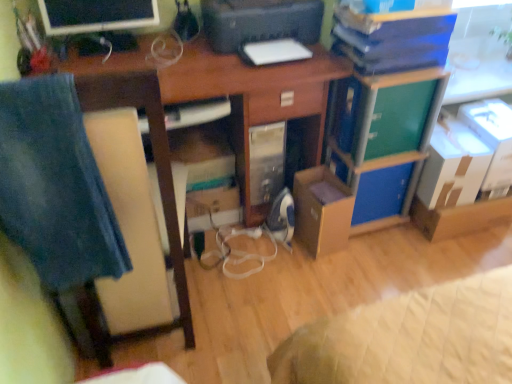
Question: Is blue cardboard box at center-right thinner than black plastic printer at upper center?

Choices:
 (A) no
 (B) yes

Answer: (B)

Question: Are blue cardboard box at center-right and black plastic printer at upper center far apart?

Choices:
 (A) no
 (B) yes

Answer: (A)

Question: Is blue cardboard box at center-right outside black plastic printer at upper center?

Choices:
 (A) no
 (B) yes

Answer: (B)

Question: From a real-world perspective, does blue cardboard box at center-right sit lower than black plastic printer at upper center?

Choices:
 (A) yes
 (B) no

Answer: (A)

Question: Does blue cardboard box at center-right have a greater height compared to black plastic printer at upper center?

Choices:
 (A) yes
 (B) no

Answer: (A)

Question: From the image's perspective, relative to green matte file cabinet at center-right, is white cardboard box at upper right, the fourth cardboard box from the left, above or below?

Choices:
 (A) above
 (B) below

Answer: (B)

Question: In the image, is white cardboard box at upper right, the fourth cardboard box from the left, on the left side or the right side of green matte file cabinet at center-right?

Choices:
 (A) left
 (B) right

Answer: (B)

Question: Is white cardboard box at upper right, which ranks as the first cardboard box in right-to-left order, wider or thinner than green matte file cabinet at center-right?

Choices:
 (A) wide
 (B) thin

Answer: (B)

Question: Looking at the image, does white cardboard box at upper right, which ranks as the first cardboard box in right-to-left order, seem bigger or smaller compared to green matte file cabinet at center-right?

Choices:
 (A) small
 (B) big

Answer: (A)

Question: Is point (291, 1) closer or farther from the camera than point (367, 220)?

Choices:
 (A) farther
 (B) closer

Answer: (B)

Question: Would you say black plastic printer at upper center is inside or outside blue cardboard box at center-right?

Choices:
 (A) outside
 (B) inside

Answer: (A)

Question: From the image's perspective, relative to blue cardboard box at center-right, is black plastic printer at upper center above or below?

Choices:
 (A) above
 (B) below

Answer: (A)

Question: In the image, is black plastic printer at upper center on the left side or the right side of blue cardboard box at center-right?

Choices:
 (A) right
 (B) left

Answer: (B)

Question: Is white cardboard box at upper right, the fourth cardboard box from the left, wider or thinner than wooden chair at left?

Choices:
 (A) thin
 (B) wide

Answer: (A)

Question: In terms of height, does white cardboard box at upper right, which ranks as the first cardboard box in right-to-left order, look taller or shorter compared to wooden chair at left?

Choices:
 (A) short
 (B) tall

Answer: (A)